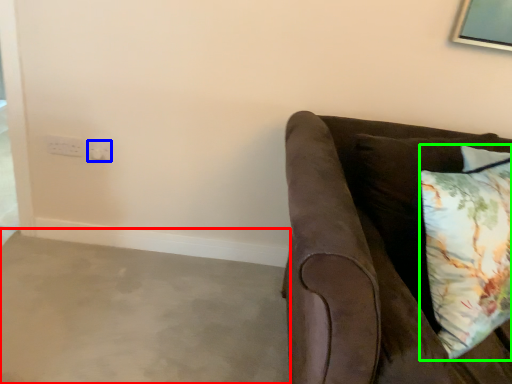
Question: Which is nearer to the concrete (highlighted by a red box)? electric outlet (highlighted by a blue box) or pillow (highlighted by a green box).

Choices:
 (A) electric outlet
 (B) pillow

Answer: (A)